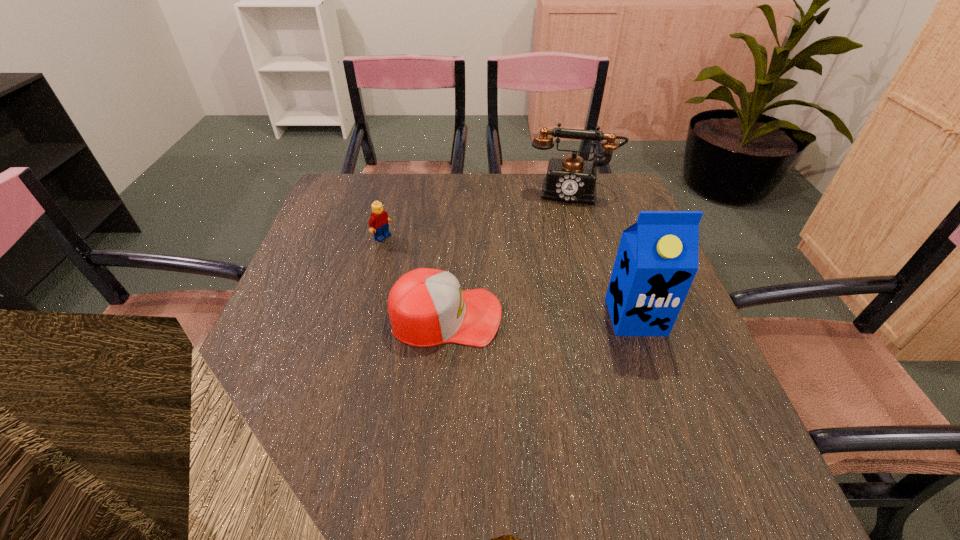
I want to click on vacant space on the desktop that is between the baseball cap and the carton and is positioned on the front of the third shortest object at the rotary dial, so click(x=561, y=316).

Find the location of a particular element. The image size is (960, 540). free space on the desktop that is between the baseball cap and the carton and is positioned on the front-facing side of the leftmost object is located at coordinates (520, 316).